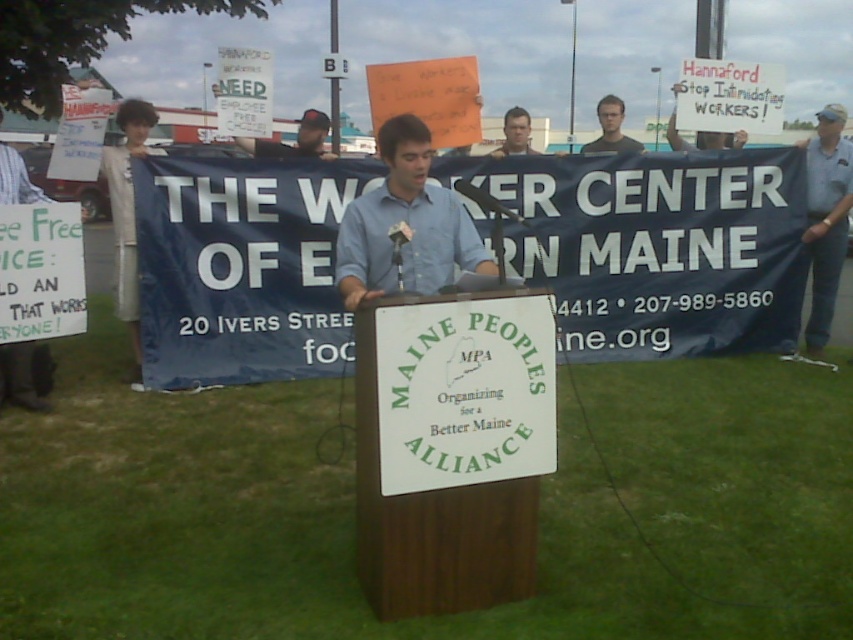
You are a photographer at the protest and want to capture both the blue shirt at center and the smooth skin face at center in a single photo. Based on their positions, which object should you position closer to the left side of the frame?

The blue shirt at center should be positioned closer to the left side of the frame since it is to the left of the smooth skin face at center.